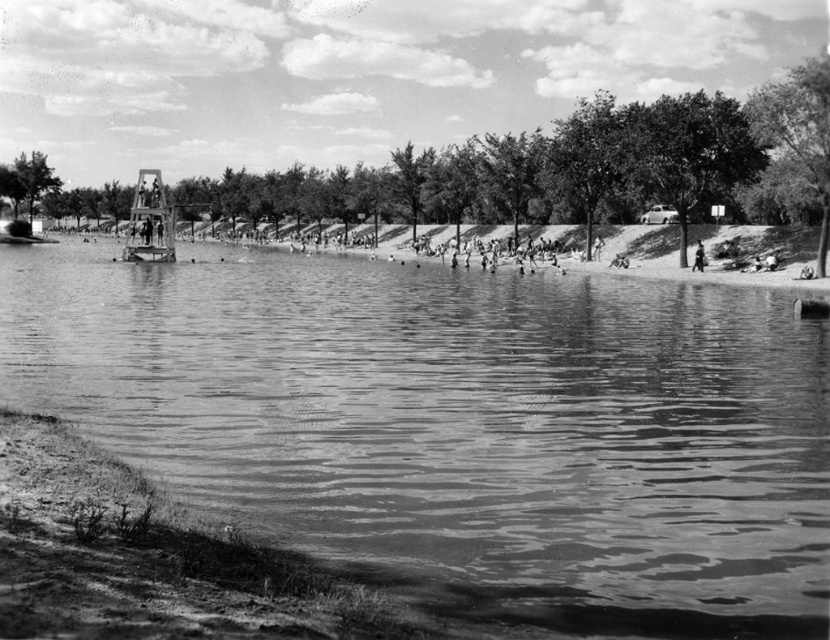
You are a photographer standing on the lakeshore. You want to capture a photo where both the smooth water at center and the metallic structure at center are clearly visible. Based on their positions, which object will appear larger in the photo?

The smooth water at center will appear larger in the photo because it is closer to the viewer than the metallic structure at center.

You are standing at the edge of the lake and see a point marked at coordinates [460,426]. Based on the scene description, is this point located on the water or on land?

The point at coordinates [460,426] is on smooth water at center, so it is located on the water.